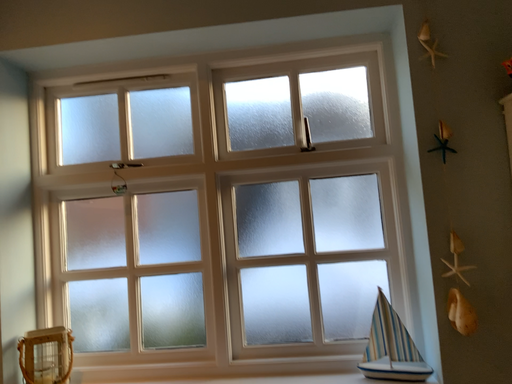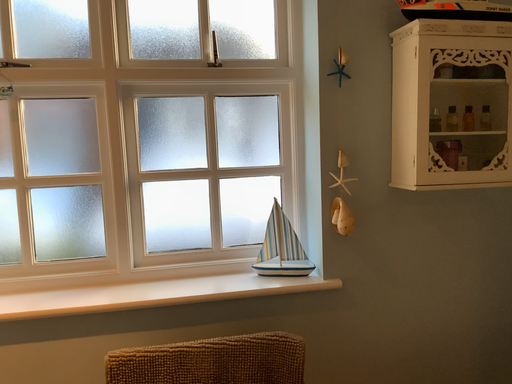
Question: Which way did the camera rotate in the video?

Choices:
 (A) rotated left
 (B) rotated right

Answer: (B)